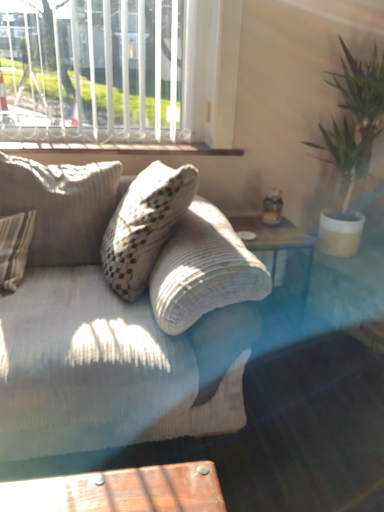
Question: From a real-world perspective, is textured beige pillow at left above or below transparent glass plate at upper right?

Choices:
 (A) below
 (B) above

Answer: (B)

Question: Is textured beige pillow at left wider or thinner than transparent glass plate at upper right?

Choices:
 (A) wide
 (B) thin

Answer: (A)

Question: Which object is the farthest from the textured beige pillow at left?

Choices:
 (A) white painted wood at upper center
 (B) white textured window at upper left
 (C) green leafy plant at right
 (D) clear glass table at center
 (E) transparent glass plate at upper right

Answer: (C)

Question: Based on their relative distances, which object is nearer to the green leafy plant at right?

Choices:
 (A) transparent glass plate at upper right
 (B) textured beige pillow at left
 (C) clear glass table at center
 (D) white textured window at upper left
 (E) white painted wood at upper center

Answer: (C)